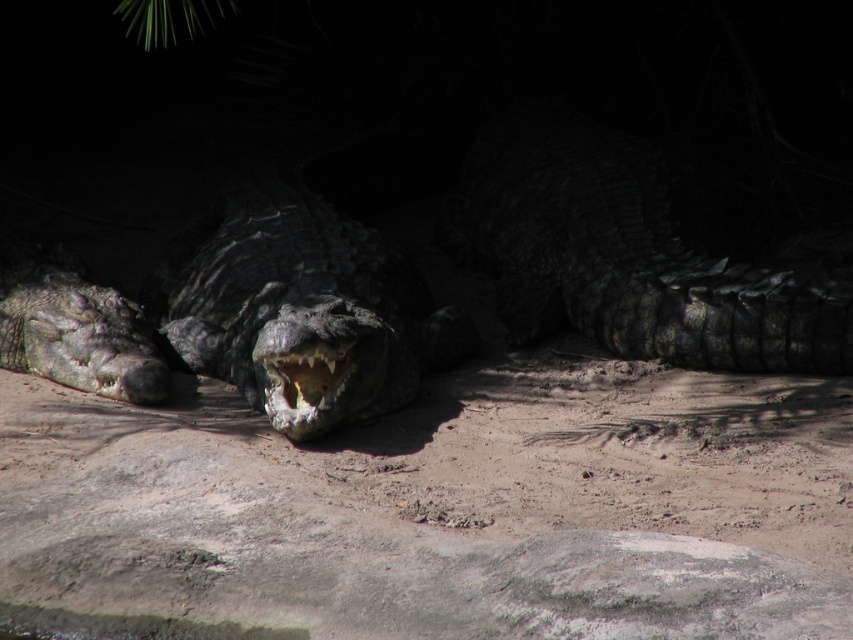
Who is shorter, dark gray scaly crocodile at left or dark gray textured mouth at center?

dark gray textured mouth at center

In the scene shown: Which is below, dark gray scaly crocodile at left or dark gray textured mouth at center?

dark gray textured mouth at center is lower down.

Which is in front, point (132, 344) or point (305, 365)?

Point (305, 365) is more forward.

The height and width of the screenshot is (640, 853). What are the coordinates of `dark gray scaly crocodile at left` in the screenshot? It's located at pyautogui.click(x=74, y=332).

Can you confirm if dark scaly crocodile at center is smaller than shiny black crocodile at center?

No, dark scaly crocodile at center is not smaller than shiny black crocodile at center.

Who is positioned more to the left, dark scaly crocodile at center or shiny black crocodile at center?

shiny black crocodile at center

Who is more forward, (x=271, y=276) or (x=254, y=252)?

Point (x=271, y=276)

Locate an element on the screen. This screenshot has height=640, width=853. dark scaly crocodile at center is located at coordinates (241, 310).

Which is in front, point (213, 285) or point (28, 291)?

Point (28, 291)

Which is in front, point (282, 198) or point (4, 257)?

Positioned in front is point (4, 257).

This screenshot has width=853, height=640. What are the coordinates of `dark scaly crocodile at center` in the screenshot? It's located at (241, 310).